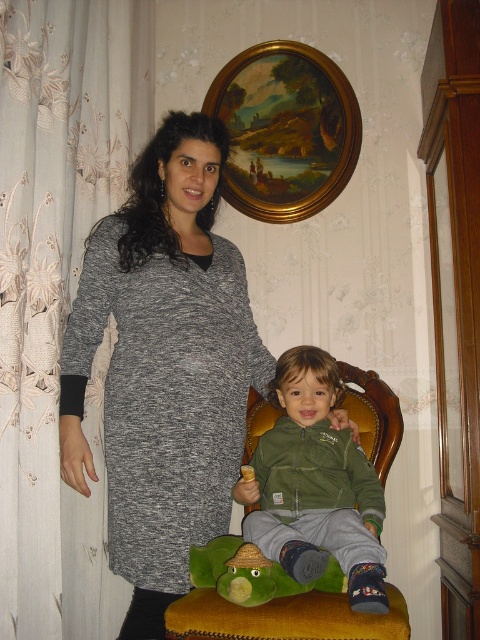
You are a photographer setting up for a family portrait. The gray knit dress at left and the green plush toy at lower center are in your frame. Based on their heights, which object should you adjust your camera angle to focus on first?

The gray knit dress at left is taller than the green plush toy at lower center, so you should adjust your camera angle to focus on the gray knit dress at left first.

You are a tailor measuring garments for alterations. You see the green fleece jacket at center and the green plush toy at lower center. Which item is taller?

The green fleece jacket at center is taller than the green plush toy at lower center.

You are a photographer setting up a shot of the scene. You want to ensure that the gray knit dress at left and the green plush toy at lower center are both in focus. Since the camera can only focus on one subject at a time, which object should you focus on to ensure the other is also in focus given their positions?

The gray knit dress at left is positioned on the left side of green plush toy at lower center. To ensure both are in focus, focus on the gray knit dress at left since it is closer to the camera, allowing the green plush toy at lower center to be within the depth of field.